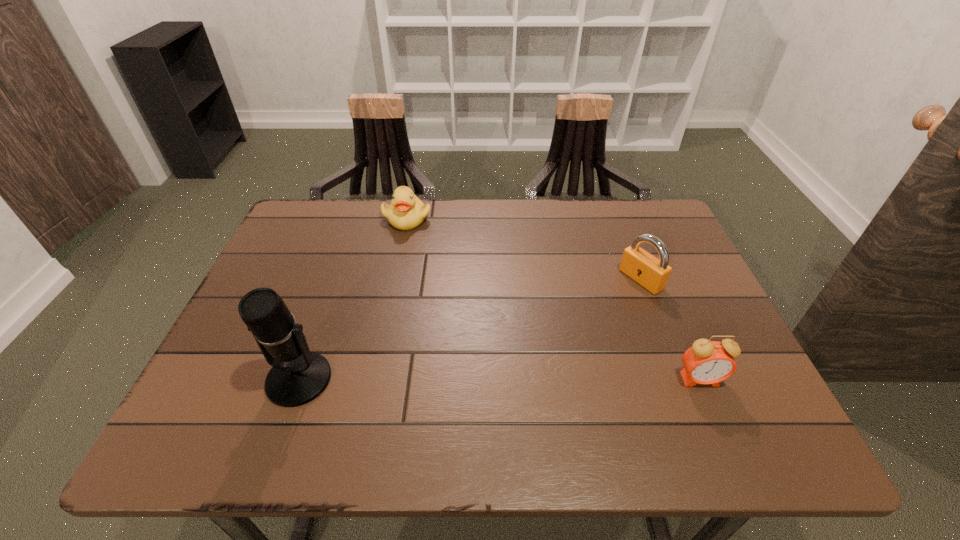
This screenshot has height=540, width=960. Identify the location of object present at the near right corner. (707, 362).

Where is `free point at the far edge`? This screenshot has height=540, width=960. free point at the far edge is located at coordinates pos(562,202).

This screenshot has height=540, width=960. What are the coordinates of `vacant region at the near edge of the desktop` in the screenshot? It's located at (529, 376).

Locate an element on the screen. vacant space at the left edge of the desktop is located at coordinates (239, 328).

At what (x,y) coordinates should I click in order to perform the action: click on vacant region at the far left corner of the desktop. Please return your answer as a coordinate pair (x, y). Looking at the image, I should click on (350, 208).

Where is `vacant space at the near left corner`? This screenshot has height=540, width=960. vacant space at the near left corner is located at coordinates (239, 381).

You are a GUI agent. You are given a task and a screenshot of the screen. Output one action in this format:
    pyautogui.click(x=<x>, y=<y>)
    Task: Click on the vacant region at the far right corner of the desktop
    The height and width of the screenshot is (540, 960).
    Given the screenshot: What is the action you would take?
    pyautogui.click(x=656, y=217)

Find the location of a particular element. Image resolution: width=960 pixels, height=540 pixels. vacant region between the alarm clock and the duckling is located at coordinates (553, 299).

The image size is (960, 540). In order to click on empty location between the microphone and the third object from right to left in this screenshot , I will do `click(353, 299)`.

You are a GUI agent. You are given a task and a screenshot of the screen. Output one action in this format:
    pyautogui.click(x=<x>, y=<y>)
    Task: Click on the free area in between the tallest object and the duckling
    
    Given the screenshot: What is the action you would take?
    pyautogui.click(x=353, y=299)